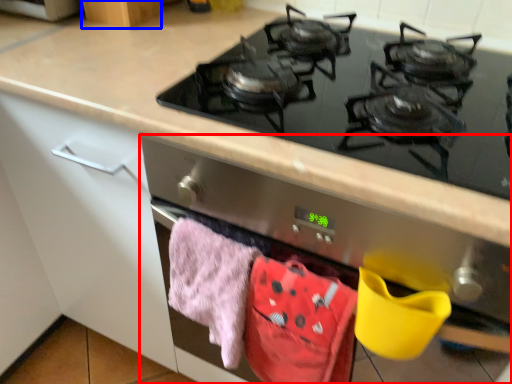
Question: Which object appears farthest to the camera in this image, oven (highlighted by a red box) or cabinetry (highlighted by a blue box)?

Choices:
 (A) oven
 (B) cabinetry

Answer: (B)